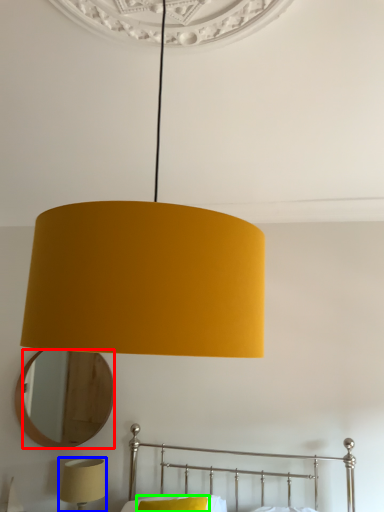
Question: Estimate the real-world distances between objects in this image. Which object is farther from mirror (highlighted by a red box), lamp (highlighted by a blue box) or pillow (highlighted by a green box)?

Choices:
 (A) lamp
 (B) pillow

Answer: (B)